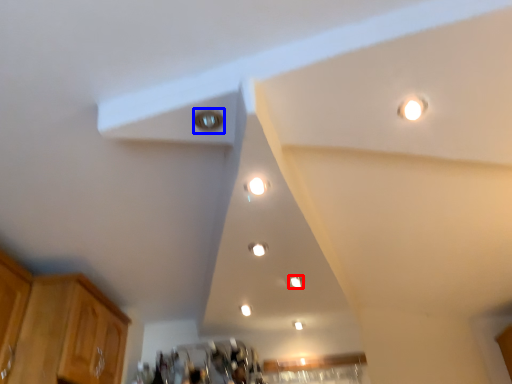
Question: Which of the following is the closest to the observer, dot (highlighted by a red box) or light (highlighted by a blue box)?

Choices:
 (A) dot
 (B) light

Answer: (B)